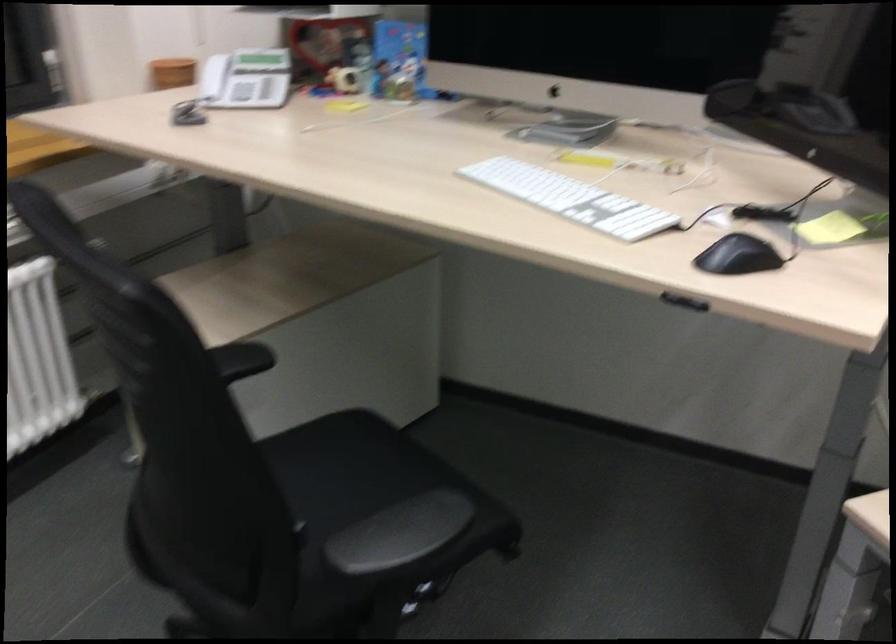
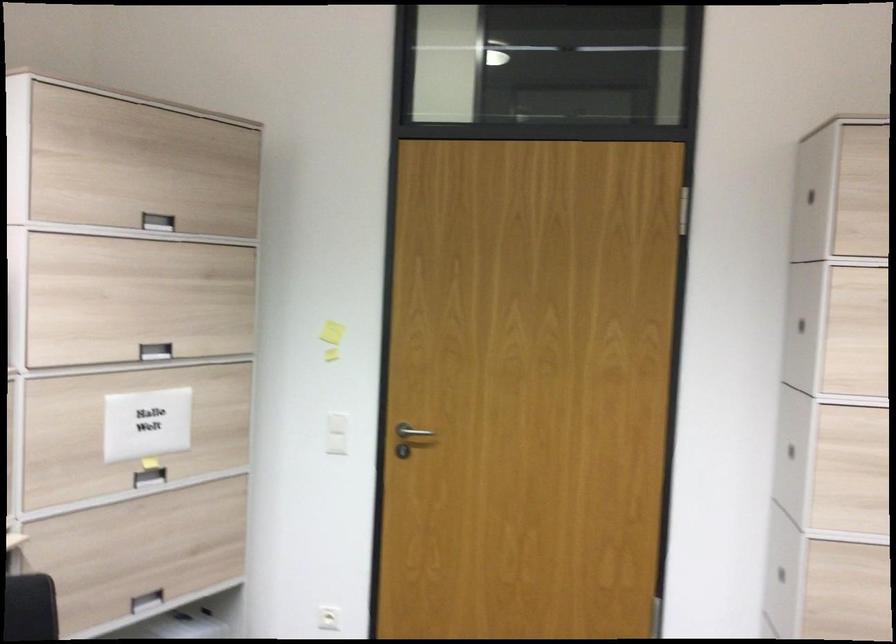
Question: How did the camera likely rotate?

Choices:
 (A) Left
 (B) Right
 (C) Up
 (D) Down

Answer: (B)